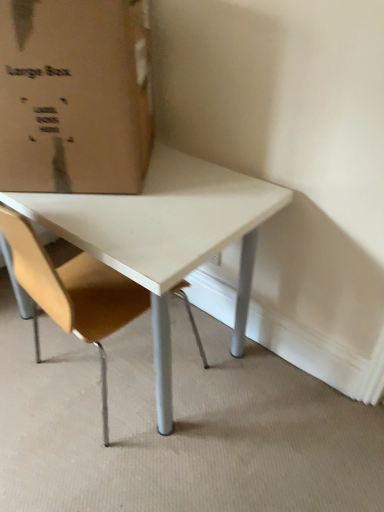
Identify the location of brown cardboard box at upper left. (75, 96).

The height and width of the screenshot is (512, 384). What do you see at coordinates (75, 96) in the screenshot? I see `brown cardboard box at upper left` at bounding box center [75, 96].

Describe the element at coordinates (73, 292) in the screenshot. I see `light brown leather chair at center` at that location.

The width and height of the screenshot is (384, 512). In order to click on light brown leather chair at center in this screenshot , I will do `click(73, 292)`.

Find the location of a particular element. Image resolution: width=384 pixels, height=512 pixels. brown cardboard box at upper left is located at coordinates pos(75,96).

Between light brown leather chair at center and brown cardboard box at upper left, which one appears on the left side from the viewer's perspective?

Positioned to the left is brown cardboard box at upper left.

Is light brown leather chair at center closer to camera compared to brown cardboard box at upper left?

Yes, light brown leather chair at center is closer to the camera.

Considering the positions of points (66, 281) and (16, 190), is point (66, 281) closer to camera compared to point (16, 190)?

No, it is not.

In the scene shown: From the image's perspective, is light brown leather chair at center over brown cardboard box at upper left?

No, from the image's perspective, light brown leather chair at center is not on top of brown cardboard box at upper left.

From a real-world perspective, which is physically below, light brown leather chair at center or brown cardboard box at upper left?

light brown leather chair at center is physically lower.

Considering the relative sizes of light brown leather chair at center and brown cardboard box at upper left in the image provided, is light brown leather chair at center thinner than brown cardboard box at upper left?

In fact, light brown leather chair at center might be wider than brown cardboard box at upper left.

Who is shorter, light brown leather chair at center or brown cardboard box at upper left?

With less height is brown cardboard box at upper left.

Considering the relative sizes of light brown leather chair at center and brown cardboard box at upper left in the image provided, is light brown leather chair at center bigger than brown cardboard box at upper left?

Yes, light brown leather chair at center is bigger than brown cardboard box at upper left.

Do you think light brown leather chair at center is within brown cardboard box at upper left, or outside of it?

light brown leather chair at center lies outside brown cardboard box at upper left.

Is light brown leather chair at center not near brown cardboard box at upper left?

No.

Could you tell me if light brown leather chair at center is turned towards brown cardboard box at upper left?

No, light brown leather chair at center is not oriented towards brown cardboard box at upper left.

At what (x,y) coordinates should I click in order to perform the action: click on cardboard box that appears above the light brown leather chair at center (from the image's perspective). Please return your answer as a coordinate pair (x, y). The width and height of the screenshot is (384, 512). Looking at the image, I should click on pyautogui.click(x=75, y=96).

In the image, is brown cardboard box at upper left on the left side or the right side of light brown leather chair at center?

From the image, it's evident that brown cardboard box at upper left is to the left of light brown leather chair at center.

Considering their positions, is brown cardboard box at upper left located in front of or behind light brown leather chair at center?

Visually, brown cardboard box at upper left is located behind light brown leather chair at center.

Between point (27, 119) and point (72, 289), which one is positioned in front?

The point (27, 119) is closer.

From the image's perspective, does brown cardboard box at upper left appear lower than light brown leather chair at center?

No, from the image's perspective, brown cardboard box at upper left is not beneath light brown leather chair at center.

From a real-world perspective, between brown cardboard box at upper left and light brown leather chair at center, who is vertically higher?

From a 3D spatial view, brown cardboard box at upper left is above.

Considering the relative sizes of brown cardboard box at upper left and light brown leather chair at center in the image provided, is brown cardboard box at upper left thinner than light brown leather chair at center?

Indeed, brown cardboard box at upper left has a lesser width compared to light brown leather chair at center.

Considering the relative sizes of brown cardboard box at upper left and light brown leather chair at center in the image provided, is brown cardboard box at upper left shorter than light brown leather chair at center?

Correct, brown cardboard box at upper left is not as tall as light brown leather chair at center.

Considering the relative sizes of brown cardboard box at upper left and light brown leather chair at center in the image provided, is brown cardboard box at upper left smaller than light brown leather chair at center?

Yes, brown cardboard box at upper left is smaller than light brown leather chair at center.

Is light brown leather chair at center located within brown cardboard box at upper left?

No, light brown leather chair at center is not a part of brown cardboard box at upper left.

Are brown cardboard box at upper left and light brown leather chair at center located far from each other?

brown cardboard box at upper left is near light brown leather chair at center, not far away.

Is brown cardboard box at upper left positioned with its back to light brown leather chair at center?

That's not correct — brown cardboard box at upper left is not looking away from light brown leather chair at center.

Locate an element on the screen. Image resolution: width=384 pixels, height=512 pixels. chair lying on the right of brown cardboard box at upper left is located at coordinates (73, 292).

Image resolution: width=384 pixels, height=512 pixels. What are the coordinates of `chair to the right of brown cardboard box at upper left` in the screenshot? It's located at (73, 292).

Image resolution: width=384 pixels, height=512 pixels. What are the coordinates of `cardboard box above the light brown leather chair at center (from a real-world perspective)` in the screenshot? It's located at (75, 96).